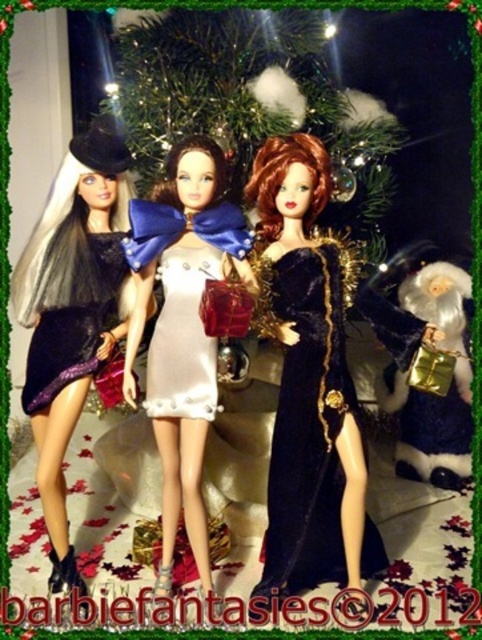
You are standing 2 meters away from the camera. You want to take a photo of the point at coordinates point [254,140]. Is the point within your reach to focus on?

The point [254,140] is 1.78 meters from the camera, so yes, it is within your reach to focus on since you are standing 2 meters away.

You are a guest at a holiday party and see the green textured wreath at upper center and the shiny black dress at left. Which object is positioned to the right of the other?

The green textured wreath at upper center is to the right of the shiny black dress at left.

You are standing in front of the festive scene with the three dolls. You notice a point marked at coordinates (252, 100). Which object is this point located on?

The point at coordinates (252, 100) is on the green textured wreath at upper center.